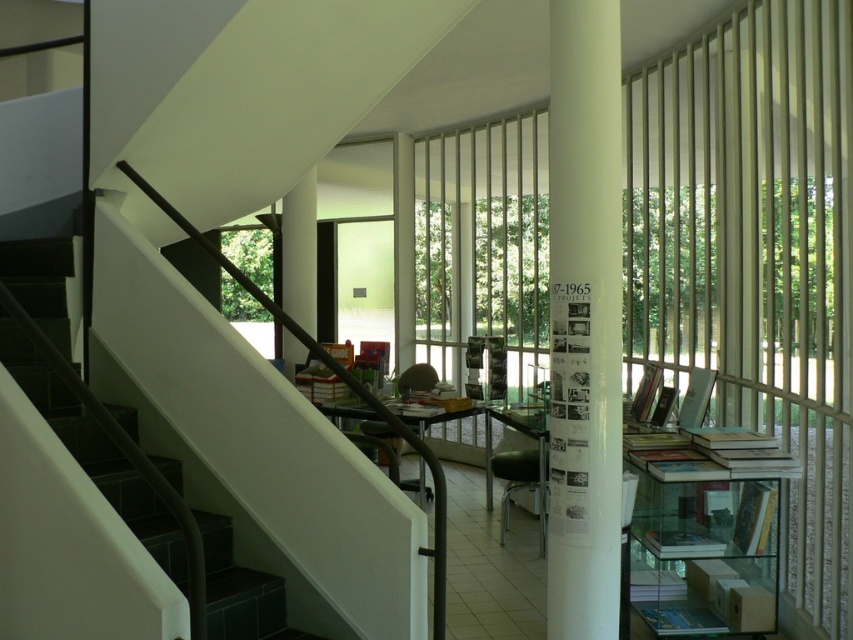
Question: Does white glossy pillar at center have a greater width compared to white glossy stairwell at left?

Choices:
 (A) no
 (B) yes

Answer: (A)

Question: Can you confirm if white glossy pillar at center is smaller than white glossy stairwell at left?

Choices:
 (A) yes
 (B) no

Answer: (A)

Question: Where is white glossy stairwell at left located in relation to hardcover book at center in the image?

Choices:
 (A) above
 (B) below

Answer: (A)

Question: Which of the following is the farthest from the observer?

Choices:
 (A) white glossy stairwell at left
 (B) white glossy pillar at center

Answer: (B)

Question: Which is farther from the white glossy stairwell at left?

Choices:
 (A) hardcover book at center
 (B) white glossy pillar at center

Answer: (A)

Question: Which of the following is the closest to the observer?

Choices:
 (A) (686, 396)
 (B) (59, 275)

Answer: (B)